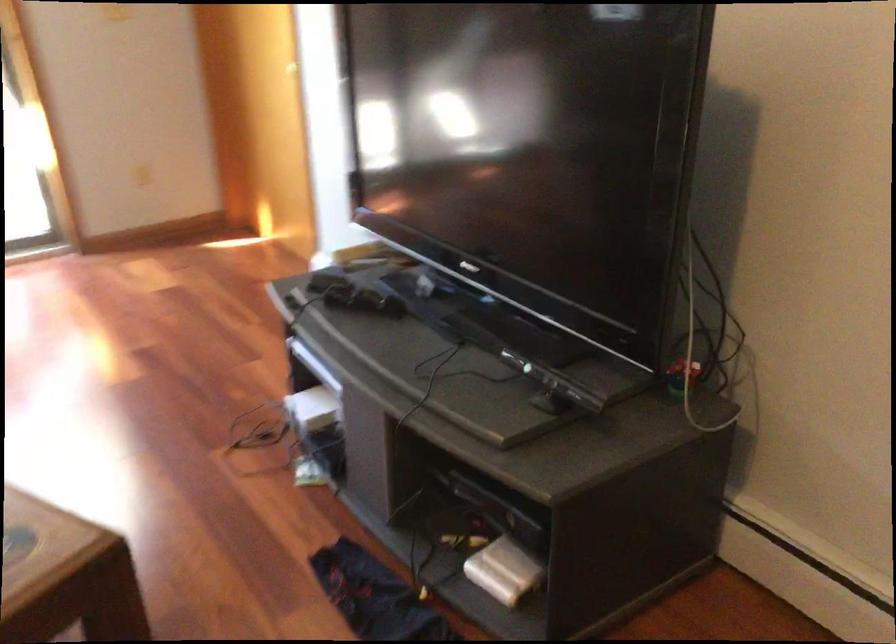
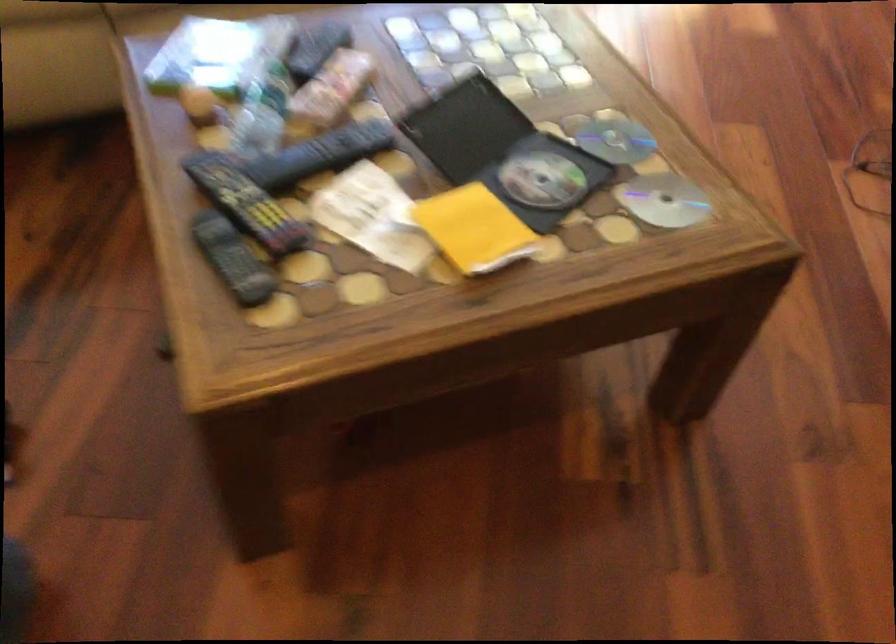
Looking at this image, how did the camera likely rotate?

The camera rotated toward left-down.